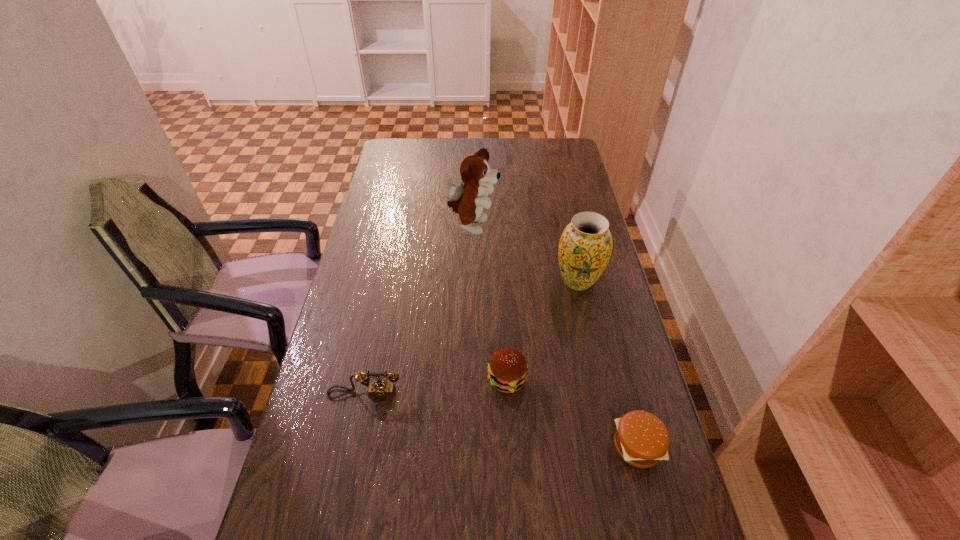
What are the coordinates of `vacant space located 0.200m on the left of the second farthest object` in the screenshot? It's located at (492, 281).

Image resolution: width=960 pixels, height=540 pixels. Find the location of `vacant region located 0.320m on the back of the left hamburger`. vacant region located 0.320m on the back of the left hamburger is located at coordinates (502, 279).

Where is `vacant region located 0.140m on the front-facing side of the telephone`? Image resolution: width=960 pixels, height=540 pixels. vacant region located 0.140m on the front-facing side of the telephone is located at coordinates (352, 455).

Image resolution: width=960 pixels, height=540 pixels. Find the location of `vacant space located 0.390m on the back of the nearer hamburger`. vacant space located 0.390m on the back of the nearer hamburger is located at coordinates (601, 305).

Locate an element on the screen. object positioned at the left edge is located at coordinates (380, 390).

The height and width of the screenshot is (540, 960). I want to click on vase located at the right edge, so click(x=585, y=247).

In order to click on hamburger that is at the right edge in this screenshot , I will do `click(641, 439)`.

Where is `vacant space at the far edge`? The image size is (960, 540). vacant space at the far edge is located at coordinates (433, 139).

In the image, there is a desktop. Identify the location of vacant space at the left edge. (324, 359).

The width and height of the screenshot is (960, 540). Find the location of `vacant region at the right edge of the desktop`. vacant region at the right edge of the desktop is located at coordinates (579, 309).